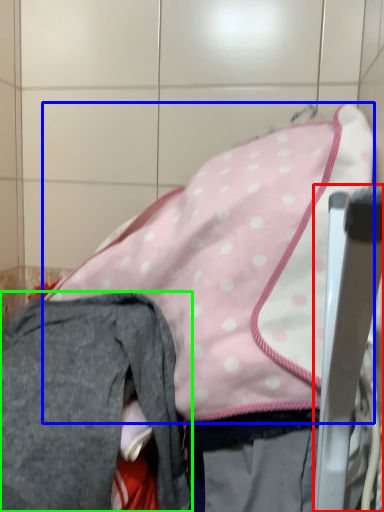
Question: Based on their relative distances, which object is farther from chair (highlighted by a red box)? Choose from wide (highlighted by a blue box) and trousers (highlighted by a green box).

Choices:
 (A) wide
 (B) trousers

Answer: (B)